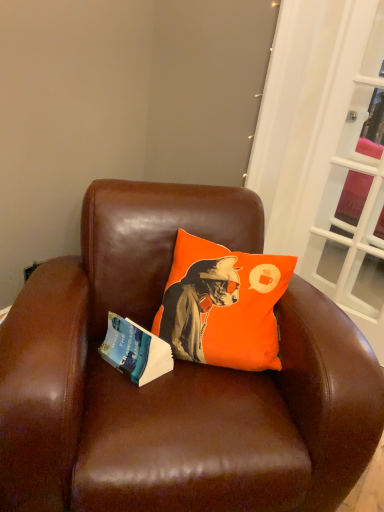
Question: Does orange fabric pillow at center have a smaller size compared to brown leather chair at center?

Choices:
 (A) no
 (B) yes

Answer: (B)

Question: Can you confirm if orange fabric pillow at center is shorter than brown leather chair at center?

Choices:
 (A) yes
 (B) no

Answer: (A)

Question: Considering the relative sizes of orange fabric pillow at center and brown leather chair at center in the image provided, is orange fabric pillow at center taller than brown leather chair at center?

Choices:
 (A) no
 (B) yes

Answer: (A)

Question: Is orange fabric pillow at center at the left side of brown leather chair at center?

Choices:
 (A) yes
 (B) no

Answer: (B)

Question: Can you see orange fabric pillow at center touching brown leather chair at center?

Choices:
 (A) yes
 (B) no

Answer: (B)

Question: Is orange fabric pillow at center positioned beyond the bounds of brown leather chair at center?

Choices:
 (A) yes
 (B) no

Answer: (B)

Question: Could you tell me if white glass screen door at right is turned towards brown leather chair at center?

Choices:
 (A) no
 (B) yes

Answer: (B)

Question: From a real-world perspective, is white glass screen door at right located beneath brown leather chair at center?

Choices:
 (A) no
 (B) yes

Answer: (A)

Question: Is white glass screen door at right thinner than brown leather chair at center?

Choices:
 (A) yes
 (B) no

Answer: (A)

Question: Is white glass screen door at right wider than brown leather chair at center?

Choices:
 (A) no
 (B) yes

Answer: (A)

Question: From a real-world perspective, is white glass screen door at right on top of brown leather chair at center?

Choices:
 (A) no
 (B) yes

Answer: (B)

Question: Can we say white glass screen door at right lies outside brown leather chair at center?

Choices:
 (A) yes
 (B) no

Answer: (A)

Question: Is blue paper book at left turned away from white glass screen door at right?

Choices:
 (A) yes
 (B) no

Answer: (B)